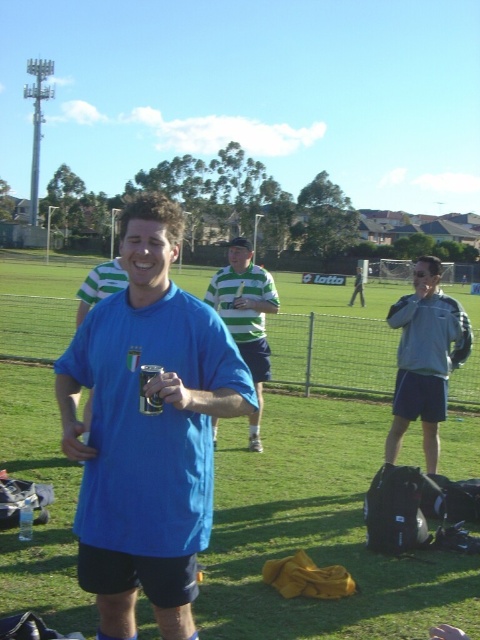
Between point (218, 593) and point (428, 433), which one is positioned in front?

Point (218, 593)

Is point (29, 602) farther from camera compared to point (393, 424)?

No, it is in front of (393, 424).

Where is `green grass at center`? This screenshot has width=480, height=640. green grass at center is located at coordinates (321, 492).

Which is in front, point (141, 244) or point (360, 285)?

Positioned in front is point (141, 244).

Consider the image. Is blue matte shirt at center to the left of green striped polo shirt at center from the viewer's perspective?

Yes, blue matte shirt at center is to the left of green striped polo shirt at center.

This screenshot has height=640, width=480. Find the location of `blue matte shirt at center`. blue matte shirt at center is located at coordinates 147,429.

Can you confirm if green striped shirt at center is shorter than green striped polo shirt at center?

Incorrect, green striped shirt at center's height does not fall short of green striped polo shirt at center's.

In the scene shown: Which of these two, green striped shirt at center or green striped polo shirt at center, stands shorter?

Standing shorter between the two is green striped polo shirt at center.

Does point (253, 288) lie behind point (357, 268)?

No, it is not.

At what (x,y) coordinates should I click in order to perform the action: click on green striped shirt at center. Please return your answer as a coordinate pair (x, y). Looking at the image, I should click on [x=245, y=316].